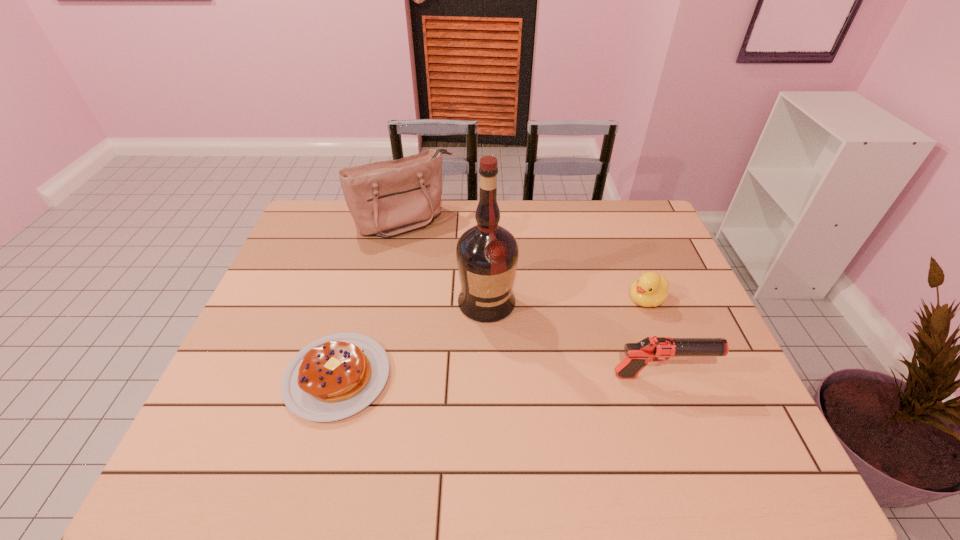
The image size is (960, 540). In order to click on object present at the left edge in this screenshot , I will do `click(334, 377)`.

This screenshot has width=960, height=540. Identify the location of gun that is at the right edge. pyautogui.click(x=649, y=349).

This screenshot has height=540, width=960. I want to click on duckling situated at the right edge, so click(x=651, y=289).

Where is `object that is at the near left corner`? This screenshot has height=540, width=960. object that is at the near left corner is located at coordinates (334, 377).

This screenshot has height=540, width=960. Find the location of `free location at the far edge`. free location at the far edge is located at coordinates (400, 237).

In the image, there is a desktop. Identify the location of vacant space at the near edge. Image resolution: width=960 pixels, height=540 pixels. (401, 421).

What are the coordinates of `free space at the left edge of the desktop` in the screenshot? It's located at [291, 360].

Locate an element on the screen. free space at the right edge is located at coordinates pyautogui.click(x=684, y=336).

In order to click on vacant point at the far left corner in this screenshot , I will do `click(315, 208)`.

Locate an element on the screen. This screenshot has width=960, height=540. free location at the near left corner of the desktop is located at coordinates (216, 405).